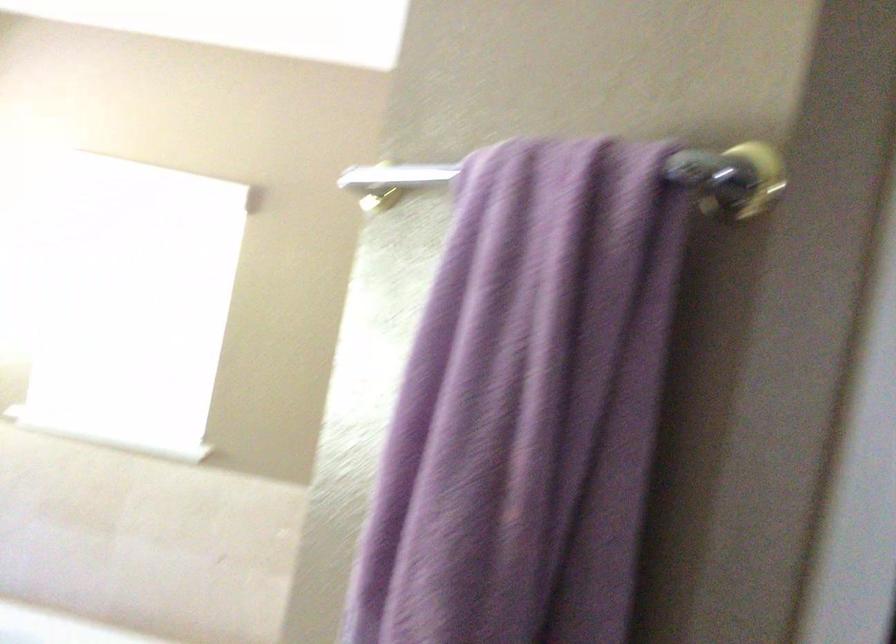
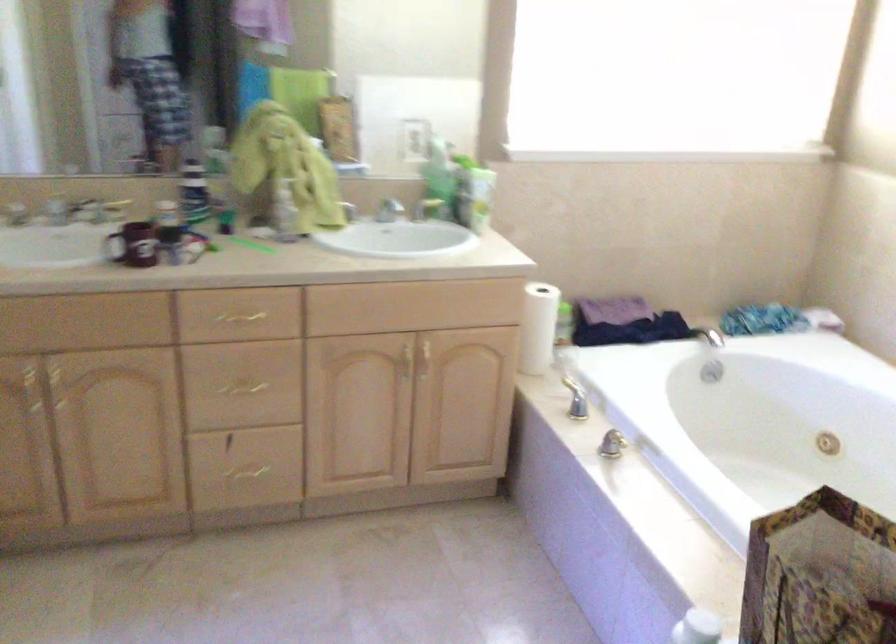
Question: How did the camera likely rotate?

Choices:
 (A) Left
 (B) Right
 (C) Up
 (D) Down

Answer: (A)